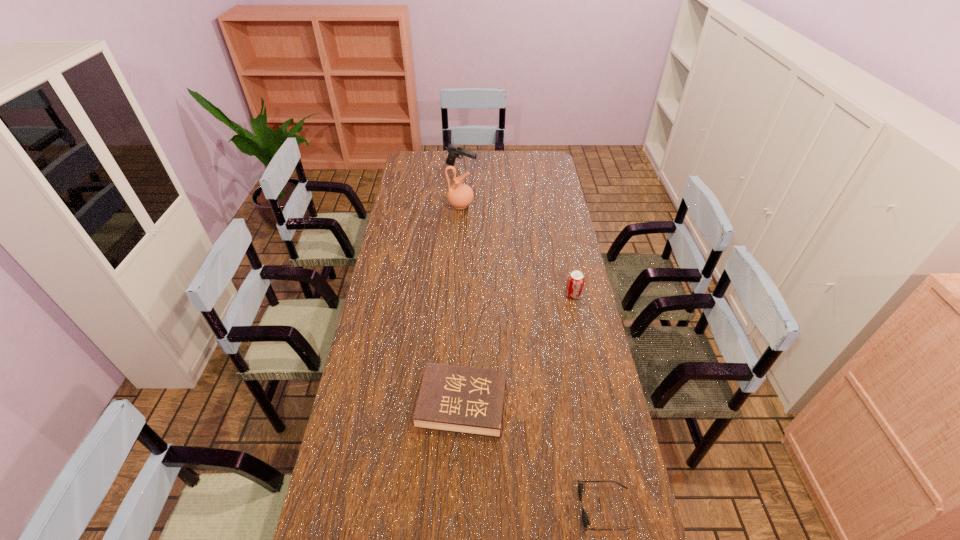
Find the location of a particular element. the tallest object is located at coordinates (x=460, y=196).

Locate an element on the screen. The image size is (960, 540). pottery is located at coordinates (460, 196).

Identify the location of gun. This screenshot has height=540, width=960. (454, 151).

At what (x,y) coordinates should I click in order to perform the action: click on the fourth shortest object. Please return your answer as a coordinate pair (x, y). The height and width of the screenshot is (540, 960). Looking at the image, I should click on (454, 151).

This screenshot has width=960, height=540. I want to click on the third tallest object, so coord(575,283).

Where is `soda`? This screenshot has height=540, width=960. soda is located at coordinates (575, 283).

I want to click on the fourth tallest object, so click(458, 399).

The image size is (960, 540). I want to click on the second nearest object, so click(x=458, y=399).

Where is `the nearest object`? The width and height of the screenshot is (960, 540). the nearest object is located at coordinates (585, 520).

This screenshot has width=960, height=540. Find the location of `sunglasses`. sunglasses is located at coordinates (585, 520).